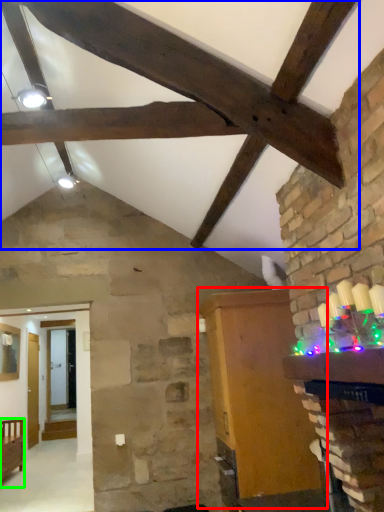
Question: Based on their relative distances, which object is nearer to furniture (highlighted by a red box)? Choose from exhaust hood (highlighted by a blue box) and furniture (highlighted by a green box).

Choices:
 (A) exhaust hood
 (B) furniture

Answer: (A)